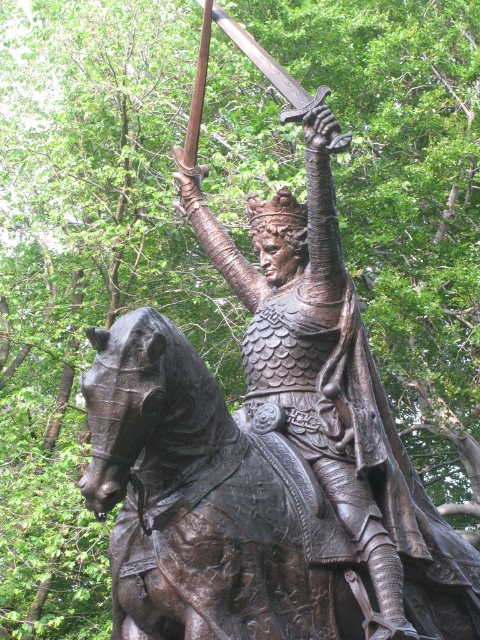
From the picture: You are a sculptor analyzing the knight statue. You need to place a protective cover over the bronze armor at center. What coordinates should you aim for to ensure precise placement?

The bronze armor at center is located at coordinates point (x=317, y=362), so you should aim for that exact point to ensure precise placement of the protective cover.

You are an art student analyzing the composition of the image. The scene contains a bronze statue of a knight on a horse. You are given a point at coordinates (208, 504). Which object in the scene does this point correspond to?

The point at coordinates (208, 504) corresponds to the bronze textured horse at center.